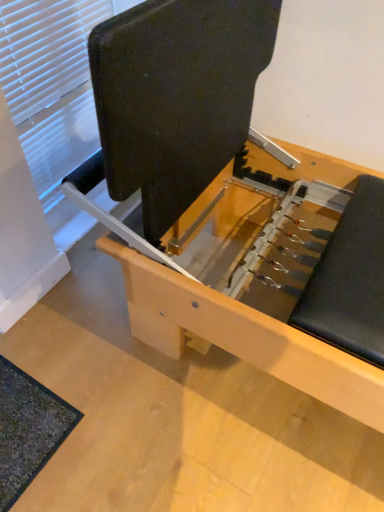
You are a GUI agent. You are given a task and a screenshot of the screen. Output one action in this format:
    pyautogui.click(x=<x>, y=<y>)
    Task: Click on the free space behind dark green textured mat at lower left
    This screenshot has height=512, width=384.
    Given the screenshot: What is the action you would take?
    pyautogui.click(x=61, y=342)